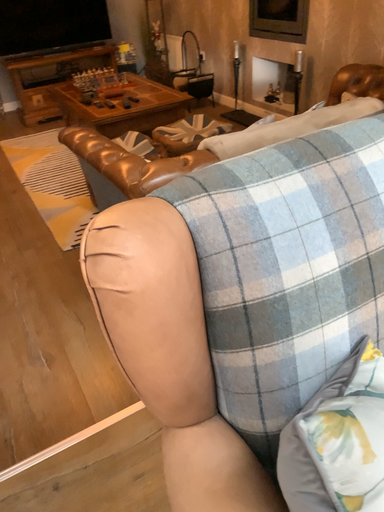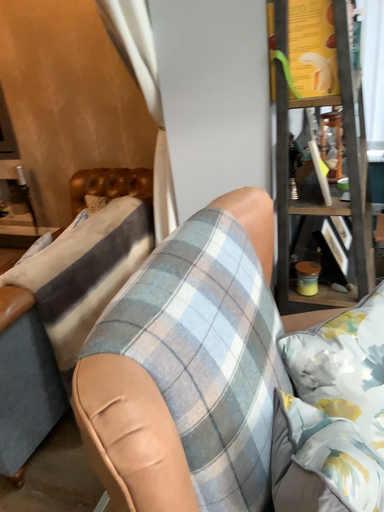
Question: How did the camera likely rotate when shooting the video?

Choices:
 (A) rotated upward
 (B) rotated downward

Answer: (A)